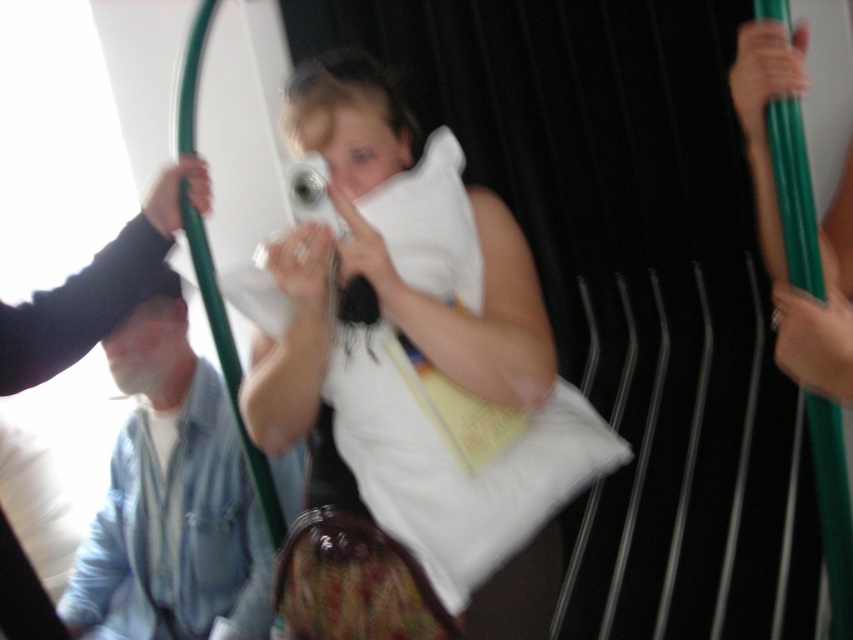
You are a passenger on a moving bus and you want to place your black fabric hand at upper left on the white soft pillow at center to rest your head. Based on the scene description, will your hand be able to reach the pillow?

The white soft pillow at center is 11.80 inches away from the black fabric hand at upper left. Since the distance is within a typical human hand reach, the hand can easily reach the pillow to rest the head.

You are a passenger on a moving train and you want to place your white soft pillow at center on the luggage rack above your seat. The rack has a maximum height limit of 36 inches. Can you safely place the pillow there without exceeding the height limit?

Answer: The white soft pillow at center is 37.82 inches away from the viewer. However, the distance from the viewer does not indicate its actual size. Without knowing the pillow size, it is impossible to determine if it exceeds the luggage rack height limit of 36 inches. Please check the pillow dimensions.